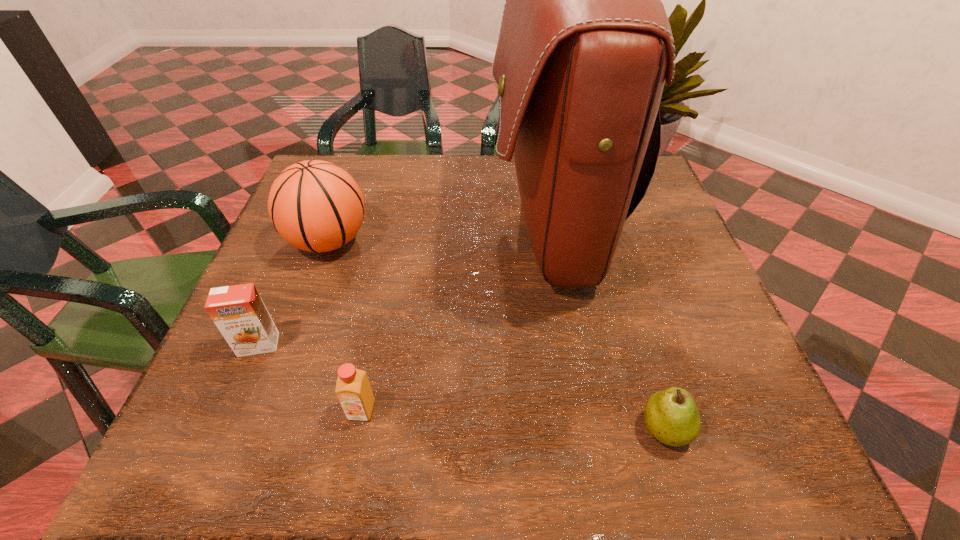
Identify the location of satchel. The height and width of the screenshot is (540, 960). (585, 44).

Locate an element on the screen. Image resolution: width=960 pixels, height=540 pixels. the second tallest object is located at coordinates (316, 206).

Locate an element on the screen. the third nearest object is located at coordinates (238, 311).

You are a GUI agent. You are given a task and a screenshot of the screen. Output one action in this format:
    pyautogui.click(x=<x>, y=<y>)
    Task: Click on the farther orange juice
    The height and width of the screenshot is (540, 960).
    Given the screenshot: What is the action you would take?
    pyautogui.click(x=238, y=311)

The width and height of the screenshot is (960, 540). Identify the location of the right orange juice. (353, 390).

At what (x,y) coordinates should I click in order to perform the action: click on the third object from right to left. Please return your answer as a coordinate pair (x, y). Looking at the image, I should click on (353, 390).

Image resolution: width=960 pixels, height=540 pixels. I want to click on pear, so click(x=671, y=415).

The image size is (960, 540). I want to click on free point located on the open flap of the tallest object, so click(436, 224).

Where is `free space located on the open flap of the tallest object`? free space located on the open flap of the tallest object is located at coordinates (448, 224).

You are a GUI agent. You are given a task and a screenshot of the screen. Output one action in this format:
    pyautogui.click(x=<x>, y=<y>)
    Task: Click on the blank space located 0.080m on the open flap of the tallest object
    This screenshot has height=540, width=960.
    Given the screenshot: What is the action you would take?
    pyautogui.click(x=457, y=224)